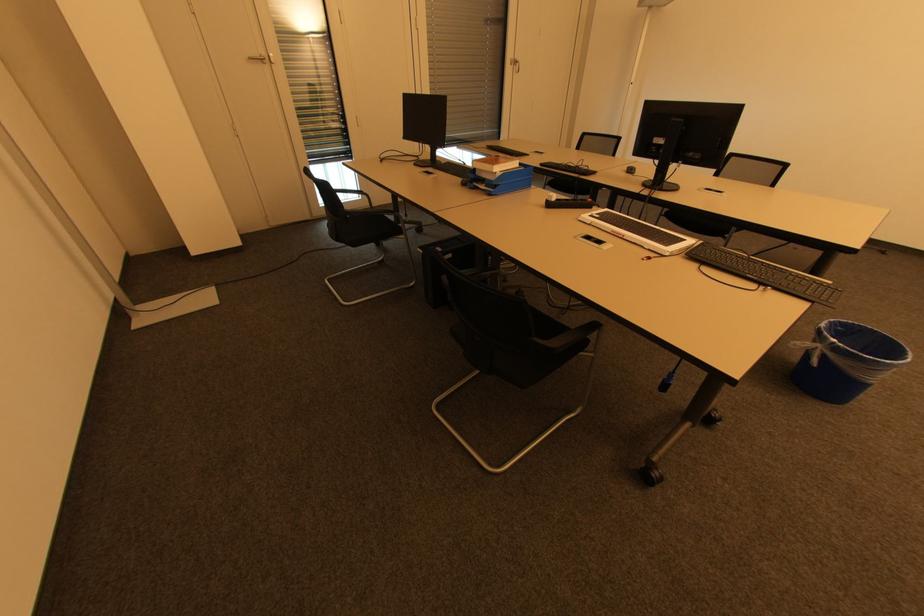
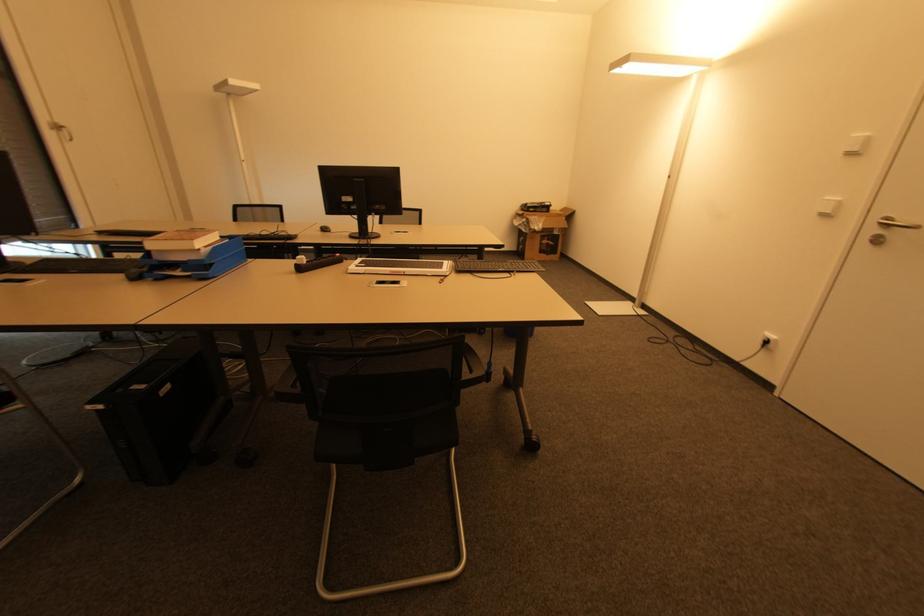
Question: The camera is either moving clockwise (left) or counter-clockwise (right) around the object. The first image is from the beginning of the video and the second image is from the end. Is the camera moving left or right when shooting the video?

Choices:
 (A) Left
 (B) Right

Answer: (A)